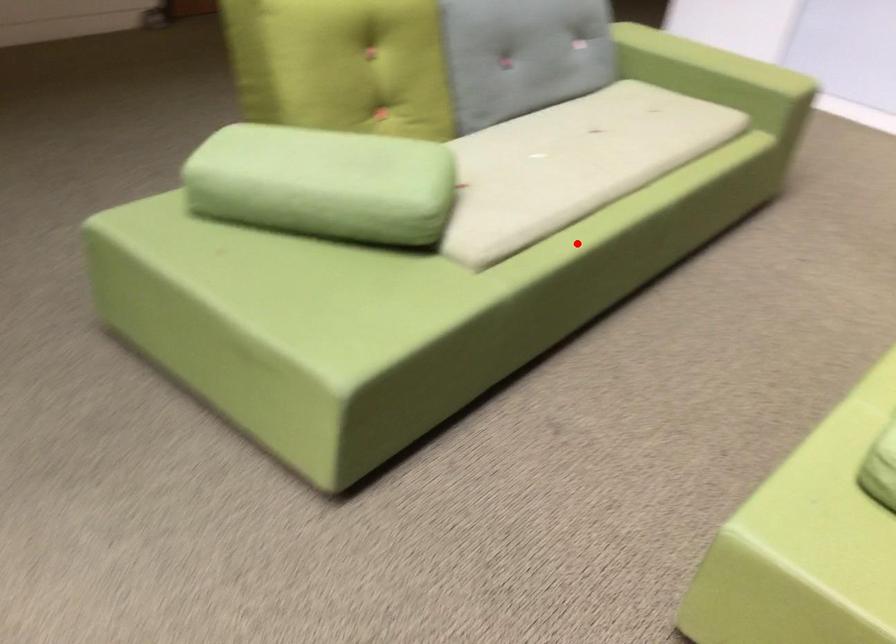
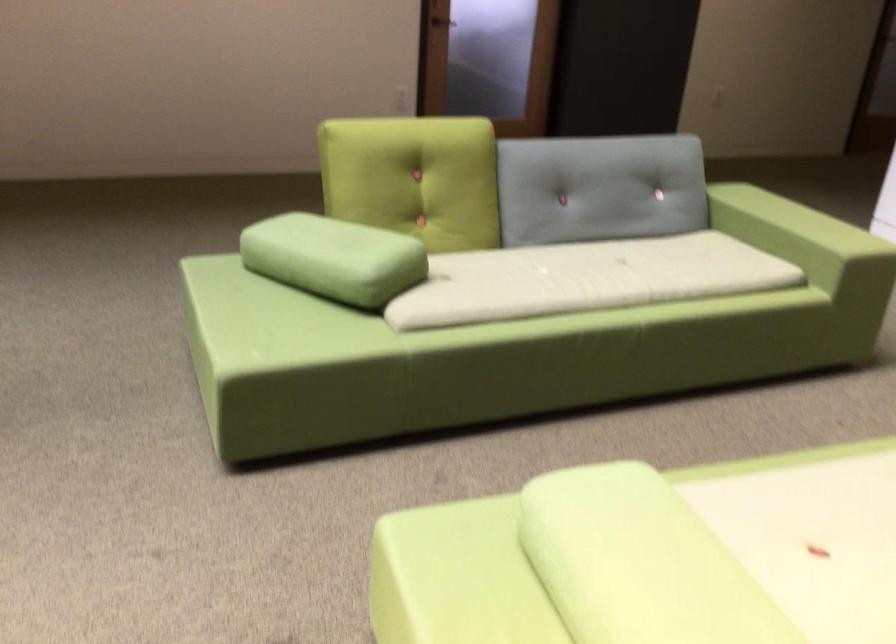
Locate, in the second image, the point that corresponds to the highlighted location in the first image.

(504, 334)